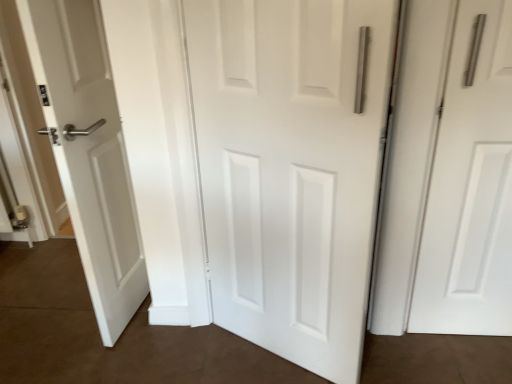
Question: Considering the positions of white matte door at right, arranged as the 2th door when viewed from the left, and white matte door at center, the 1th door in the left-to-right sequence, in the image, is white matte door at right, arranged as the 2th door when viewed from the left, wider or thinner than white matte door at center, the 1th door in the left-to-right sequence,?

Choices:
 (A) wide
 (B) thin

Answer: (A)

Question: In terms of height, does white matte door at right, which ranks as the first door in right-to-left order, look taller or shorter compared to white matte door at center, the 2th door when ordered from right to left?

Choices:
 (A) tall
 (B) short

Answer: (B)

Question: Based on their positions, is white matte door at right, arranged as the 2th door when viewed from the left, located to the left or right of white matte door at center, the 1th door in the left-to-right sequence?

Choices:
 (A) left
 (B) right

Answer: (B)

Question: From a real-world perspective, is white matte door at center, the 2th door when ordered from right to left, above or below white matte door at right, which ranks as the first door in right-to-left order?

Choices:
 (A) below
 (B) above

Answer: (B)

Question: From the image's perspective, relative to white matte door at right, which ranks as the first door in right-to-left order, is white matte door at center, the 2th door when ordered from right to left, above or below?

Choices:
 (A) below
 (B) above

Answer: (A)

Question: Considering the positions of white matte door at center, the 2th door when ordered from right to left, and white matte door at right, arranged as the 2th door when viewed from the left, in the image, is white matte door at center, the 2th door when ordered from right to left, bigger or smaller than white matte door at right, arranged as the 2th door when viewed from the left,?

Choices:
 (A) big
 (B) small

Answer: (A)

Question: From their relative heights in the image, would you say white matte door at center, the 1th door in the left-to-right sequence, is taller or shorter than white matte door at right, arranged as the 2th door when viewed from the left?

Choices:
 (A) tall
 (B) short

Answer: (A)